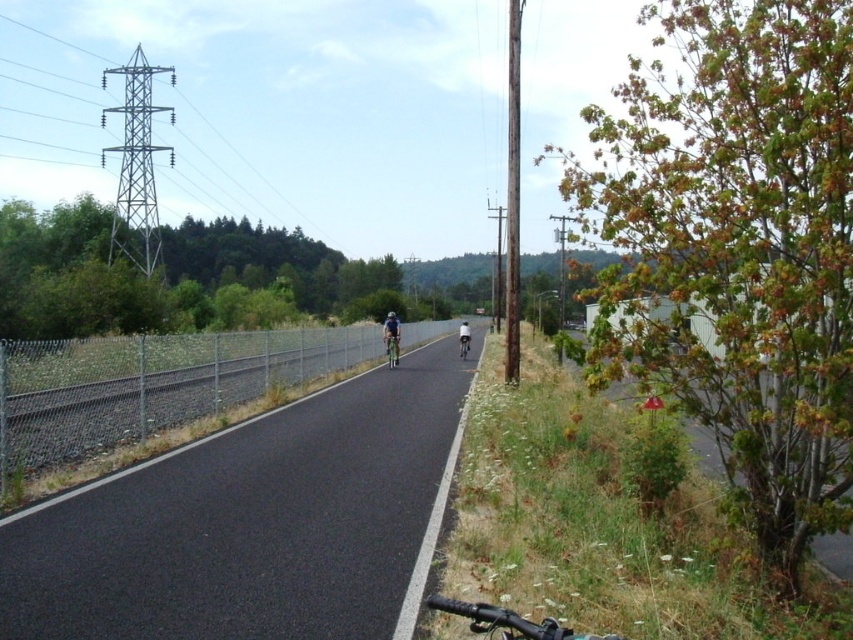
Can you confirm if asphalt road at center is positioned to the left of white matte bicycle helmet at center?

Indeed, asphalt road at center is positioned on the left side of white matte bicycle helmet at center.

Describe the element at coordinates (251, 522) in the screenshot. This screenshot has width=853, height=640. I see `asphalt road at center` at that location.

Does point (335, 637) come closer to viewer compared to point (466, 323)?

Yes, point (335, 637) is closer to viewer.

Locate an element on the screen. This screenshot has height=640, width=853. asphalt road at center is located at coordinates (251, 522).

Based on the photo, is blue fabric helmet at center further to the viewer compared to white matte bicycle helmet at center?

No, blue fabric helmet at center is in front of white matte bicycle helmet at center.

Is point (393, 312) positioned before point (463, 324)?

No.

Locate an element on the screen. This screenshot has width=853, height=640. blue fabric helmet at center is located at coordinates (392, 337).

Is blue matte helmet at center to the left of white matte bicycle helmet at center from the viewer's perspective?

Correct, you'll find blue matte helmet at center to the left of white matte bicycle helmet at center.

Is point (389, 314) positioned before point (462, 324)?

Yes, it is.

Image resolution: width=853 pixels, height=640 pixels. I want to click on blue matte helmet at center, so click(392, 316).